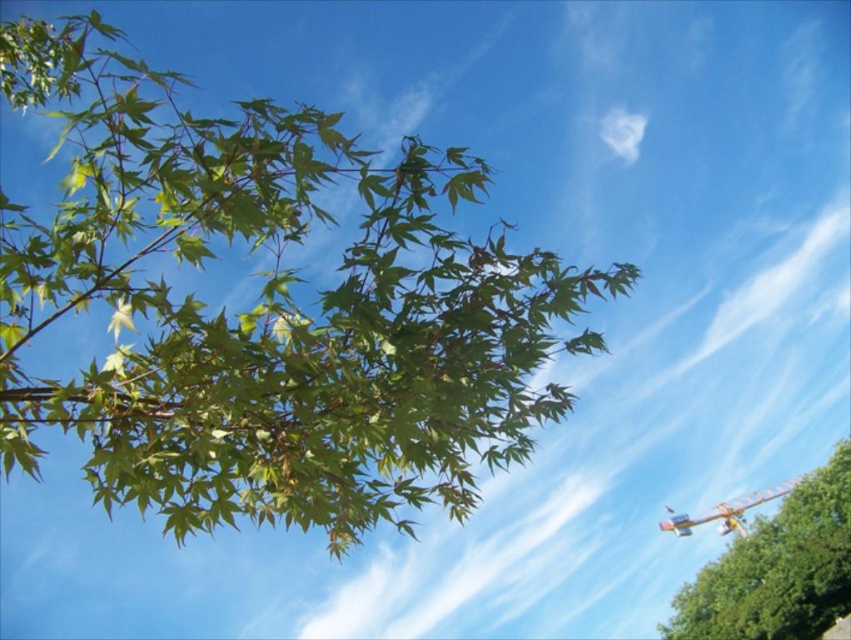
Looking at this image, is green matte leaves at upper left behind green matte tree at upper left?

That is False.

Does point (283, 308) come in front of point (801, 534)?

Yes, it is in front of point (801, 534).

Locate an element on the screen. Image resolution: width=851 pixels, height=640 pixels. green matte leaves at upper left is located at coordinates (267, 308).

Is green matte leaves at upper left wider than yellow metallic biplane at lower right?

Correct, the width of green matte leaves at upper left exceeds that of yellow metallic biplane at lower right.

Is point (303, 170) farther from viewer compared to point (786, 484)?

No, (303, 170) is closer to viewer.

The height and width of the screenshot is (640, 851). What are the coordinates of `green matte leaves at upper left` in the screenshot? It's located at [267, 308].

Consider the image. Is green matte tree at upper left to the left of yellow metallic biplane at lower right from the viewer's perspective?

Correct, you'll find green matte tree at upper left to the left of yellow metallic biplane at lower right.

Does green matte tree at upper left come behind yellow metallic biplane at lower right?

No, it is not.

Is point (777, 609) less distant than point (701, 522)?

Yes, point (777, 609) is closer to viewer.

The height and width of the screenshot is (640, 851). I want to click on green matte tree at upper left, so click(777, 568).